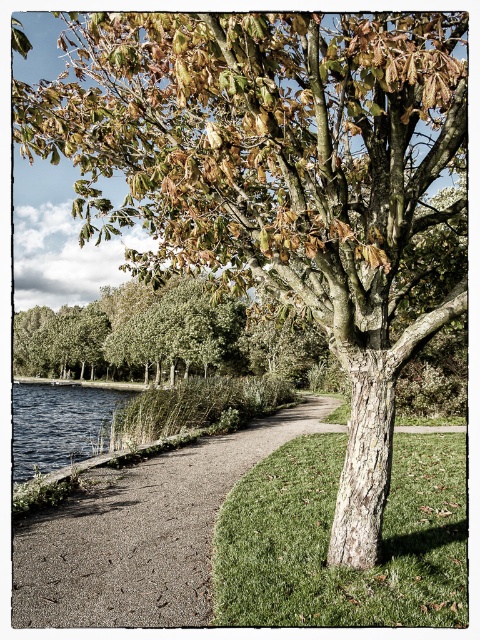
Question: Among these objects, which one is farthest from the camera?

Choices:
 (A) blue water at lower left
 (B) gravel path at center
 (C) green grass at center

Answer: (A)

Question: Does gravel path at center have a lesser width compared to blue water at lower left?

Choices:
 (A) yes
 (B) no

Answer: (A)

Question: Does green grass at center have a greater width compared to gravel path at center?

Choices:
 (A) yes
 (B) no

Answer: (B)

Question: Which of these objects is positioned closest to the blue water at lower left?

Choices:
 (A) gravel path at center
 (B) green grass at center

Answer: (B)

Question: Does gravel path at center appear over blue water at lower left?

Choices:
 (A) no
 (B) yes

Answer: (B)

Question: Which object is farther from the camera taking this photo?

Choices:
 (A) gravel path at center
 (B) green grass at center

Answer: (A)